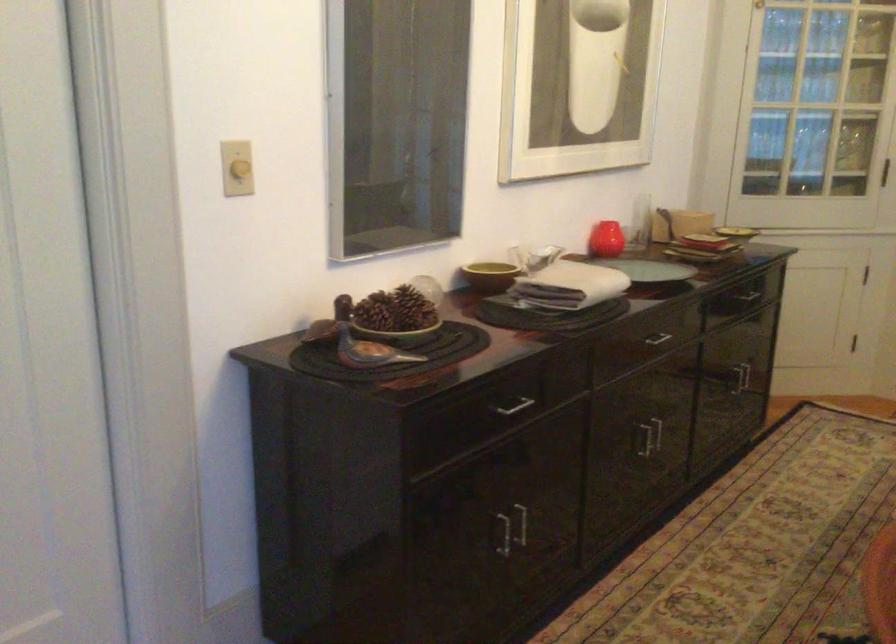
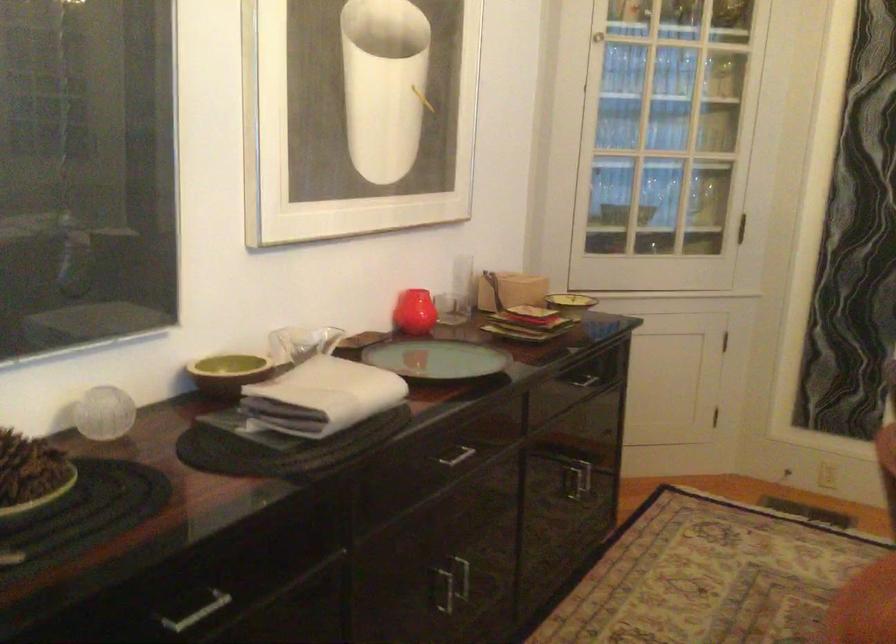
Locate, in the second image, the point that corresponds to (659,337) in the first image.

(453, 455)